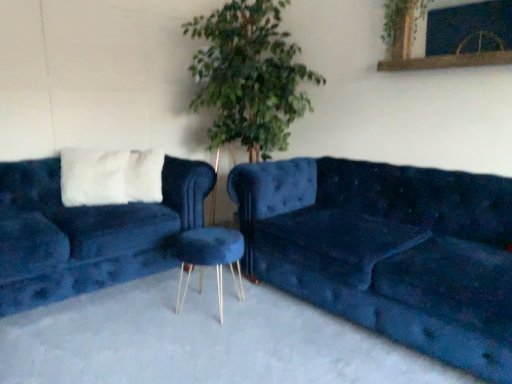
Where is `space that is in front of velvet blue couch at left, acting as the second studio couch starting from the right`? The image size is (512, 384). space that is in front of velvet blue couch at left, acting as the second studio couch starting from the right is located at coordinates (117, 336).